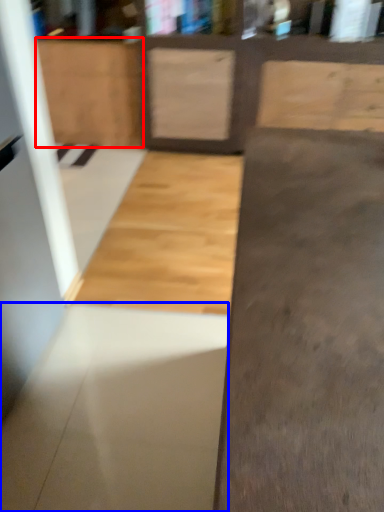
Question: Which of the following is the farthest to the observer, cabinetry (highlighted by a red box) or concrete (highlighted by a blue box)?

Choices:
 (A) cabinetry
 (B) concrete

Answer: (A)